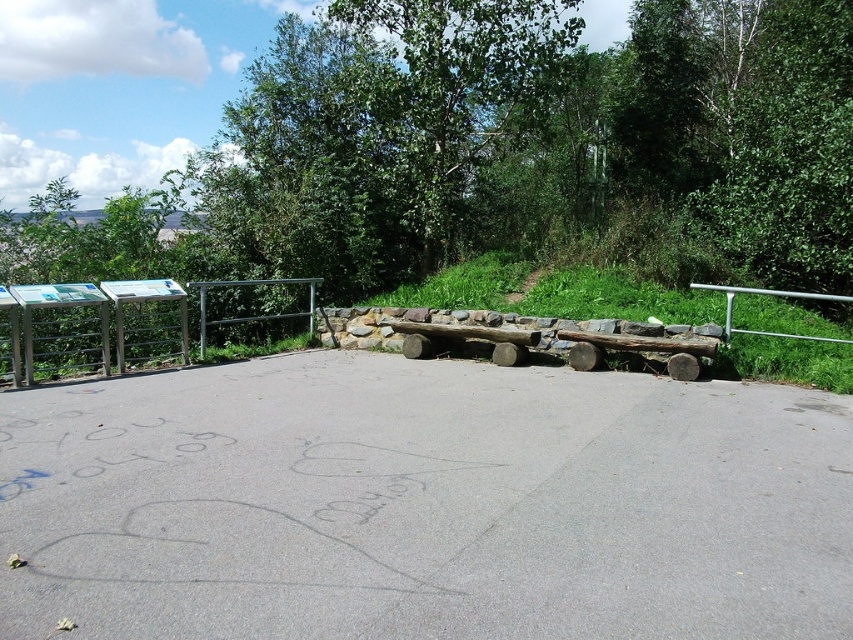
Question: Is silver metallic fence at left to the left of silver metallic rail at right from the viewer's perspective?

Choices:
 (A) yes
 (B) no

Answer: (A)

Question: Among these points, which one is farthest from the camera?

Choices:
 (A) (775, 337)
 (B) (146, 324)

Answer: (B)

Question: Does silver metallic fence at left appear on the left side of silver metallic rail at right?

Choices:
 (A) no
 (B) yes

Answer: (B)

Question: Observing the image, what is the correct spatial positioning of silver metallic fence at left in reference to silver metallic rail at right?

Choices:
 (A) below
 (B) above

Answer: (A)